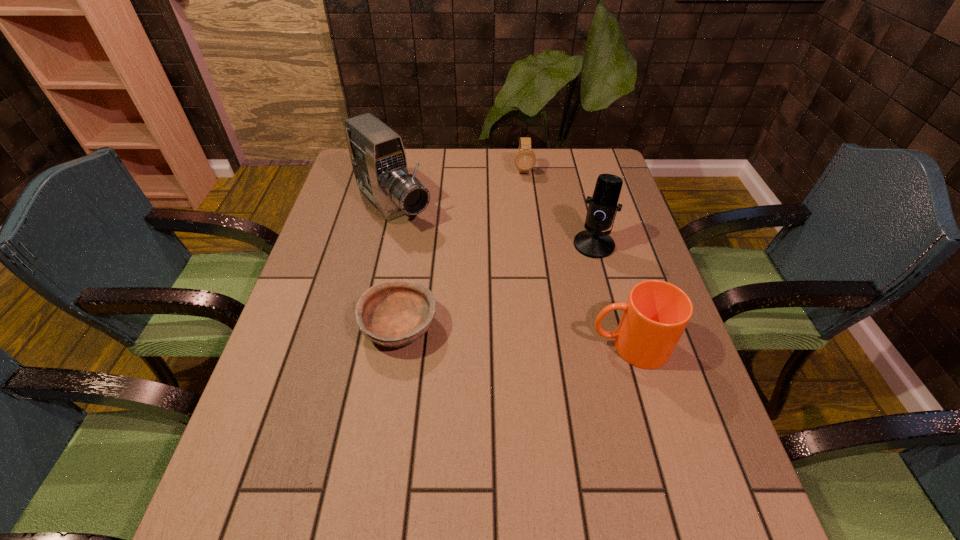
Locate an element on the screen. free spot located on the stand of the microphone is located at coordinates (516, 337).

Find the location of `vacant space situated 0.290m on the stand of the microphone`. vacant space situated 0.290m on the stand of the microphone is located at coordinates (527, 323).

This screenshot has width=960, height=540. In order to click on free space located 0.360m on the stand of the microphone in this screenshot , I will do `click(511, 342)`.

Where is `free region located 0.140m at the front of the camcorder, highlighting the lens`? Image resolution: width=960 pixels, height=540 pixels. free region located 0.140m at the front of the camcorder, highlighting the lens is located at coordinates (441, 258).

You are a GUI agent. You are given a task and a screenshot of the screen. Output one action in this format:
    pyautogui.click(x=<x>, y=<y>)
    Task: Click on the blank area located at the front of the camcorder, highlighting the lens
    This screenshot has height=540, width=960.
    Given the screenshot: What is the action you would take?
    436,254

This screenshot has width=960, height=540. I want to click on blank space located 0.070m at the front of the camcorder, highlighting the lens, so click(x=427, y=244).

Find the location of a particular element. free region located on the face of the second shortest object is located at coordinates (530, 221).

The width and height of the screenshot is (960, 540). Find the location of `free spot located 0.170m on the face of the second shortest object`. free spot located 0.170m on the face of the second shortest object is located at coordinates (528, 208).

Where is `free region located 0.370m on the face of the second shortest object`? This screenshot has width=960, height=540. free region located 0.370m on the face of the second shortest object is located at coordinates (534, 253).

Where is `camcorder that is at the far edge`? camcorder that is at the far edge is located at coordinates (378, 157).